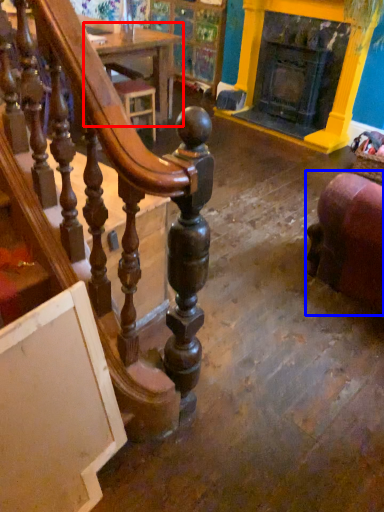
Question: Which object appears closest to the camera in this image, table (highlighted by a red box) or furniture (highlighted by a blue box)?

Choices:
 (A) table
 (B) furniture

Answer: (B)